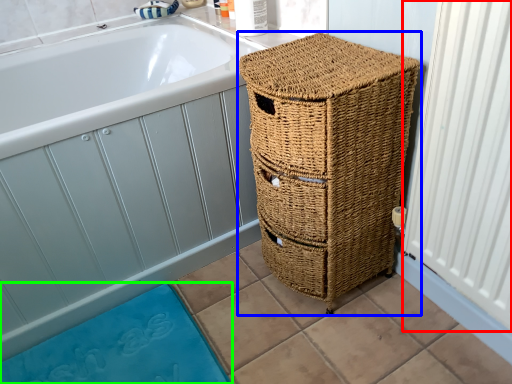
Question: Estimate the real-world distances between objects in this image. Which object is closer to radiator (highlighted by a red box), furniture (highlighted by a blue box) or bath mat (highlighted by a green box)?

Choices:
 (A) furniture
 (B) bath mat

Answer: (A)